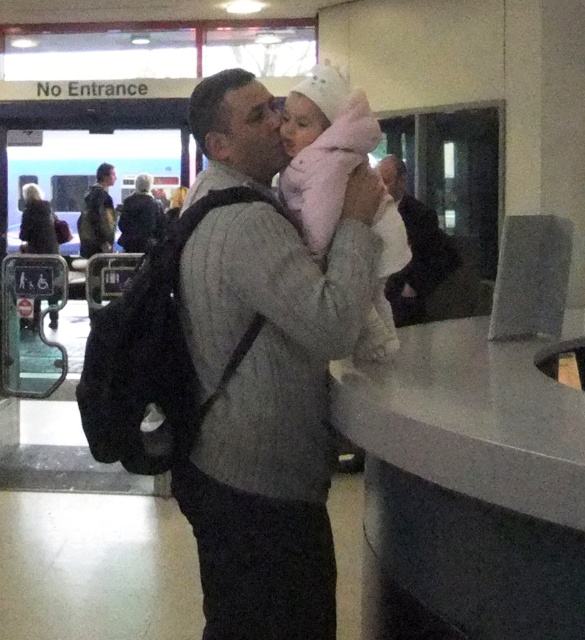
Question: Which object is farther from the camera taking this photo?

Choices:
 (A) dark gray suit at center
 (B) gray wool sweater at center

Answer: (A)

Question: Is pink fluffy coat at center positioned at the back of dark gray suit at center?

Choices:
 (A) no
 (B) yes

Answer: (A)

Question: Can you confirm if gray wool sweater at center is bigger than dark gray backpack at center?

Choices:
 (A) yes
 (B) no

Answer: (A)

Question: Considering the real-world distances, which object is farthest from the gray wool sweater at center?

Choices:
 (A) camouflage fabric jacket at left
 (B) dark gray suit at center

Answer: (A)

Question: Does gray wool sweater at center have a greater width compared to pink fluffy coat at center?

Choices:
 (A) yes
 (B) no

Answer: (A)

Question: Among these points, which one is nearest to the camera?

Choices:
 (A) (345, 120)
 (B) (283, 333)

Answer: (B)